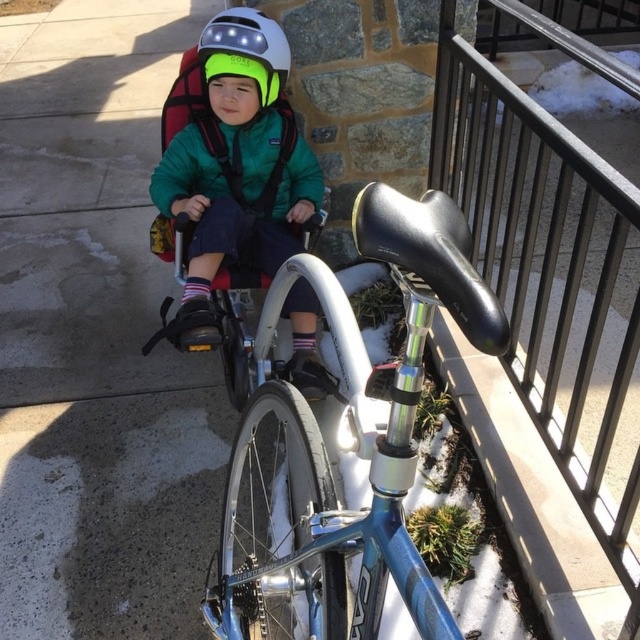
Between black metal railing at upper right and shiny blue frame at center, which one is positioned higher?

Positioned higher is black metal railing at upper right.

Find the location of a particular element. black metal railing at upper right is located at coordinates (552, 282).

Is point (612, 298) farther from camera compared to point (440, 220)?

Yes.

The height and width of the screenshot is (640, 640). What are the coordinates of `black metal railing at upper right` in the screenshot? It's located at (552, 282).

Does green matte jacket at center appear on the left side of white matte helmet at upper center?

Correct, you'll find green matte jacket at center to the left of white matte helmet at upper center.

Is green matte jacket at center to the right of white matte helmet at upper center from the viewer's perspective?

No, green matte jacket at center is not to the right of white matte helmet at upper center.

The height and width of the screenshot is (640, 640). What do you see at coordinates (232, 163) in the screenshot? I see `green matte jacket at center` at bounding box center [232, 163].

You are a GUI agent. You are given a task and a screenshot of the screen. Output one action in this format:
    pyautogui.click(x=<x>, y=<y>)
    Task: Click on the green matte jacket at center
    The width and height of the screenshot is (640, 640).
    Given the screenshot: What is the action you would take?
    pyautogui.click(x=232, y=163)

Does black metal railing at upper right appear over green matte jacket at center?

Yes, black metal railing at upper right is above green matte jacket at center.

The image size is (640, 640). Identify the location of black metal railing at upper right. (552, 282).